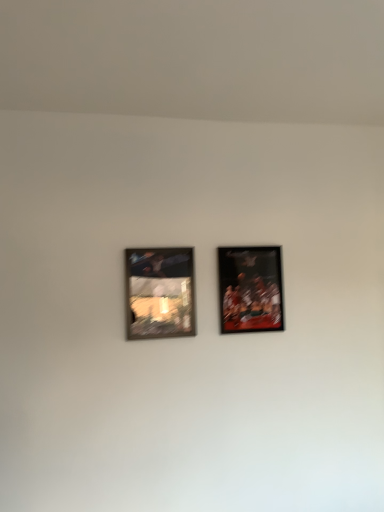
The height and width of the screenshot is (512, 384). In order to click on wooden frame at left, the 1th picture frame from the left in this screenshot , I will do `click(159, 293)`.

Describe the element at coordinates (159, 293) in the screenshot. The height and width of the screenshot is (512, 384). I see `wooden frame at left, the 1th picture frame from the left` at that location.

The width and height of the screenshot is (384, 512). What do you see at coordinates (250, 289) in the screenshot? I see `matte black picture frame at right, marked as the first picture frame in a right-to-left arrangement` at bounding box center [250, 289].

Locate an element on the screen. matte black picture frame at right, marked as the first picture frame in a right-to-left arrangement is located at coordinates (250, 289).

This screenshot has width=384, height=512. I want to click on wooden frame at left, the second picture frame in the right-to-left sequence, so click(159, 293).

Does matte black picture frame at right, the 2th picture frame positioned from the left, appear on the left side of wooden frame at left, the second picture frame in the right-to-left sequence?

No, matte black picture frame at right, the 2th picture frame positioned from the left, is not to the left of wooden frame at left, the second picture frame in the right-to-left sequence.

Does matte black picture frame at right, marked as the first picture frame in a right-to-left arrangement, come behind wooden frame at left, the 1th picture frame from the left?

Yes, it is.

Considering the points (241, 327) and (170, 251), which point is in front, point (241, 327) or point (170, 251)?

Point (170, 251)

From the picture: From the image's perspective, is matte black picture frame at right, marked as the first picture frame in a right-to-left arrangement, above wooden frame at left, the second picture frame in the right-to-left sequence?

Correct, matte black picture frame at right, marked as the first picture frame in a right-to-left arrangement, appears higher than wooden frame at left, the second picture frame in the right-to-left sequence, in the image.

From a real-world perspective, which is physically below, matte black picture frame at right, the 2th picture frame positioned from the left, or wooden frame at left, the 1th picture frame from the left?

wooden frame at left, the 1th picture frame from the left, is physically lower.

Considering the sizes of objects matte black picture frame at right, the 2th picture frame positioned from the left, and wooden frame at left, the second picture frame in the right-to-left sequence, in the image provided, who is wider, matte black picture frame at right, the 2th picture frame positioned from the left, or wooden frame at left, the second picture frame in the right-to-left sequence,?

Wider between the two is matte black picture frame at right, the 2th picture frame positioned from the left.

Considering the relative sizes of matte black picture frame at right, marked as the first picture frame in a right-to-left arrangement, and wooden frame at left, the second picture frame in the right-to-left sequence, in the image provided, is matte black picture frame at right, marked as the first picture frame in a right-to-left arrangement, shorter than wooden frame at left, the second picture frame in the right-to-left sequence,?

No.

Is matte black picture frame at right, the 2th picture frame positioned from the left, bigger or smaller than wooden frame at left, the second picture frame in the right-to-left sequence?

Clearly, matte black picture frame at right, the 2th picture frame positioned from the left, is larger in size than wooden frame at left, the second picture frame in the right-to-left sequence.

Is matte black picture frame at right, the 2th picture frame positioned from the left, located outside wooden frame at left, the 1th picture frame from the left?

Absolutely, matte black picture frame at right, the 2th picture frame positioned from the left, is external to wooden frame at left, the 1th picture frame from the left.

Is matte black picture frame at right, marked as the first picture frame in a right-to-left arrangement, not close to wooden frame at left, the second picture frame in the right-to-left sequence?

That's not correct — matte black picture frame at right, marked as the first picture frame in a right-to-left arrangement, is a little close to wooden frame at left, the second picture frame in the right-to-left sequence.

Is wooden frame at left, the 1th picture frame from the left, at the back of matte black picture frame at right, the 2th picture frame positioned from the left?

No, matte black picture frame at right, the 2th picture frame positioned from the left, is not facing away from wooden frame at left, the 1th picture frame from the left.

What's the angular difference between matte black picture frame at right, the 2th picture frame positioned from the left, and wooden frame at left, the 1th picture frame from the left,'s facing directions?

The angular difference between matte black picture frame at right, the 2th picture frame positioned from the left, and wooden frame at left, the 1th picture frame from the left, is 0.015 degrees.

This screenshot has width=384, height=512. Find the location of `picture frame above the wooden frame at left, the second picture frame in the right-to-left sequence (from a real-world perspective)`. picture frame above the wooden frame at left, the second picture frame in the right-to-left sequence (from a real-world perspective) is located at coordinates (250, 289).

From the picture: Is wooden frame at left, the 1th picture frame from the left, at the right side of matte black picture frame at right, the 2th picture frame positioned from the left?

In fact, wooden frame at left, the 1th picture frame from the left, is to the left of matte black picture frame at right, the 2th picture frame positioned from the left.

Is wooden frame at left, the second picture frame in the right-to-left sequence, closer to camera compared to matte black picture frame at right, marked as the first picture frame in a right-to-left arrangement?

Yes, wooden frame at left, the second picture frame in the right-to-left sequence, is closer to the camera.

Considering the points (143, 309) and (252, 279), which point is behind, point (143, 309) or point (252, 279)?

The point (252, 279) is farther from the camera.

From the image's perspective, is wooden frame at left, the second picture frame in the right-to-left sequence, below matte black picture frame at right, the 2th picture frame positioned from the left?

Indeed, from the image's perspective, wooden frame at left, the second picture frame in the right-to-left sequence, is shown beneath matte black picture frame at right, the 2th picture frame positioned from the left.

From a real-world perspective, is wooden frame at left, the second picture frame in the right-to-left sequence, physically located above or below matte black picture frame at right, marked as the first picture frame in a right-to-left arrangement?

wooden frame at left, the second picture frame in the right-to-left sequence, is below matte black picture frame at right, marked as the first picture frame in a right-to-left arrangement.

Which of these two, wooden frame at left, the second picture frame in the right-to-left sequence, or matte black picture frame at right, marked as the first picture frame in a right-to-left arrangement, is thinner?

wooden frame at left, the second picture frame in the right-to-left sequence.

Considering the sizes of objects wooden frame at left, the second picture frame in the right-to-left sequence, and matte black picture frame at right, marked as the first picture frame in a right-to-left arrangement, in the image provided, who is shorter, wooden frame at left, the second picture frame in the right-to-left sequence, or matte black picture frame at right, marked as the first picture frame in a right-to-left arrangement,?

With less height is wooden frame at left, the second picture frame in the right-to-left sequence.

Which of these two, wooden frame at left, the second picture frame in the right-to-left sequence, or matte black picture frame at right, the 2th picture frame positioned from the left, is smaller?

wooden frame at left, the second picture frame in the right-to-left sequence.

Is wooden frame at left, the second picture frame in the right-to-left sequence, located outside matte black picture frame at right, the 2th picture frame positioned from the left?

Yes, wooden frame at left, the second picture frame in the right-to-left sequence, is located beyond the bounds of matte black picture frame at right, the 2th picture frame positioned from the left.

Is wooden frame at left, the second picture frame in the right-to-left sequence, next to matte black picture frame at right, the 2th picture frame positioned from the left, and touching it?

wooden frame at left, the second picture frame in the right-to-left sequence, is not next to matte black picture frame at right, the 2th picture frame positioned from the left, and they're not touching.

Is wooden frame at left, the 1th picture frame from the left, oriented towards matte black picture frame at right, marked as the first picture frame in a right-to-left arrangement?

No.

How many degrees apart are the facing directions of wooden frame at left, the second picture frame in the right-to-left sequence, and matte black picture frame at right, marked as the first picture frame in a right-to-left arrangement?

0.015 degrees separate the facing orientations of wooden frame at left, the second picture frame in the right-to-left sequence, and matte black picture frame at right, marked as the first picture frame in a right-to-left arrangement.

How distant is wooden frame at left, the 1th picture frame from the left, from matte black picture frame at right, the 2th picture frame positioned from the left?

wooden frame at left, the 1th picture frame from the left, is 12.34 inches from matte black picture frame at right, the 2th picture frame positioned from the left.

In order to click on picture frame lying on the left of matte black picture frame at right, the 2th picture frame positioned from the left in this screenshot , I will do `click(159, 293)`.

The image size is (384, 512). I want to click on picture frame in front of the matte black picture frame at right, marked as the first picture frame in a right-to-left arrangement, so click(x=159, y=293).

Where is `picture frame below the matte black picture frame at right, marked as the first picture frame in a right-to-left arrangement (from a real-world perspective)`? picture frame below the matte black picture frame at right, marked as the first picture frame in a right-to-left arrangement (from a real-world perspective) is located at coordinates (159, 293).